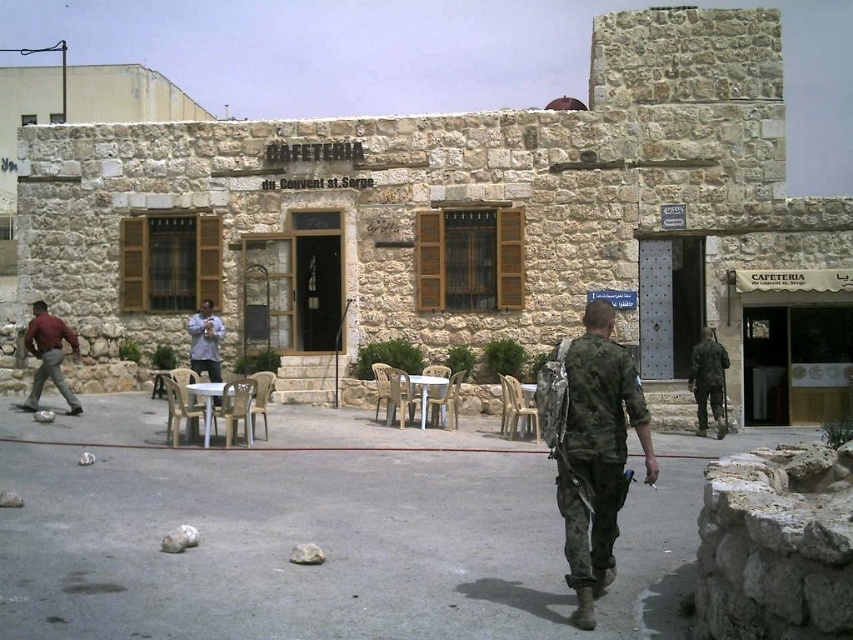
Which is in front, point (570, 445) or point (198, 365)?

Positioned in front is point (570, 445).

Does camouflage uniform at center come in front of light brown wooden chair at center?

Yes.

The width and height of the screenshot is (853, 640). In order to click on camouflage uniform at center in this screenshot , I will do `click(596, 452)`.

Looking at this image, between camouflage uniform at center and camouflage fabric uniform at center, which one appears on the left side from the viewer's perspective?

camouflage uniform at center is more to the left.

Is camouflage uniform at center wider than camouflage fabric uniform at center?

Yes, camouflage uniform at center is wider than camouflage fabric uniform at center.

Does point (602, 433) come closer to viewer compared to point (698, 369)?

Yes, it is.

You are a GUI agent. You are given a task and a screenshot of the screen. Output one action in this format:
    pyautogui.click(x=<x>, y=<y>)
    Task: Click on the camouflage uniform at center
    The height and width of the screenshot is (640, 853).
    Given the screenshot: What is the action you would take?
    pyautogui.click(x=596, y=452)

Which is more to the left, matte red shirt at left or light brown wooden chair at center?

From the viewer's perspective, matte red shirt at left appears more on the left side.

Does matte red shirt at left have a larger size compared to light brown wooden chair at center?

Indeed, matte red shirt at left has a larger size compared to light brown wooden chair at center.

The image size is (853, 640). What are the coordinates of `matte red shirt at left` in the screenshot? It's located at (48, 355).